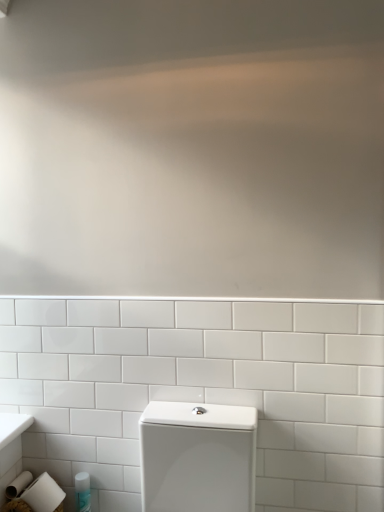
Question: Is white glossy toilet at lower center completely or partially outside of translucent plastic bottle at lower left?

Choices:
 (A) yes
 (B) no

Answer: (A)

Question: Is white glossy toilet at lower center to the right of translucent plastic bottle at lower left from the viewer's perspective?

Choices:
 (A) no
 (B) yes

Answer: (B)

Question: Is white glossy toilet at lower center far from translucent plastic bottle at lower left?

Choices:
 (A) no
 (B) yes

Answer: (A)

Question: From a real-world perspective, is white glossy toilet at lower center on translucent plastic bottle at lower left?

Choices:
 (A) no
 (B) yes

Answer: (B)

Question: Does white glossy toilet at lower center have a lesser width compared to translucent plastic bottle at lower left?

Choices:
 (A) no
 (B) yes

Answer: (A)

Question: Can you confirm if white glossy toilet at lower center is taller than translucent plastic bottle at lower left?

Choices:
 (A) yes
 (B) no

Answer: (A)

Question: From a real-world perspective, is translucent plastic bottle at lower left physically above white glossy toilet at lower center?

Choices:
 (A) no
 (B) yes

Answer: (A)

Question: Is translucent plastic bottle at lower left oriented towards white glossy toilet at lower center?

Choices:
 (A) no
 (B) yes

Answer: (A)

Question: Is translucent plastic bottle at lower left far from white glossy toilet at lower center?

Choices:
 (A) no
 (B) yes

Answer: (A)

Question: Can you confirm if translucent plastic bottle at lower left is wider than white glossy toilet at lower center?

Choices:
 (A) yes
 (B) no

Answer: (B)

Question: From a real-world perspective, is translucent plastic bottle at lower left under white glossy toilet at lower center?

Choices:
 (A) no
 (B) yes

Answer: (B)

Question: Is white glossy toilet at lower center at the back of translucent plastic bottle at lower left?

Choices:
 (A) yes
 (B) no

Answer: (B)

Question: Does point (206, 437) appear closer or farther from the camera than point (79, 508)?

Choices:
 (A) closer
 (B) farther

Answer: (A)